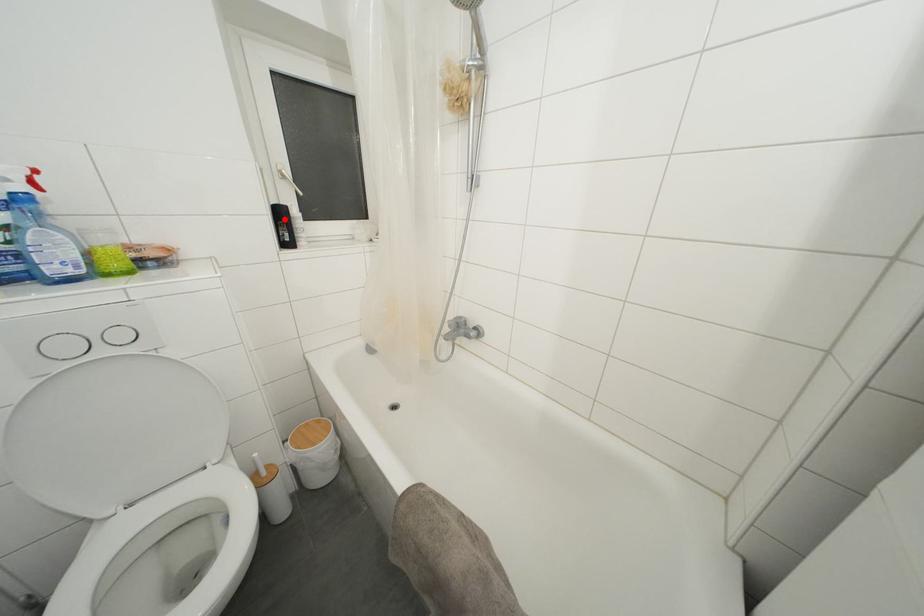
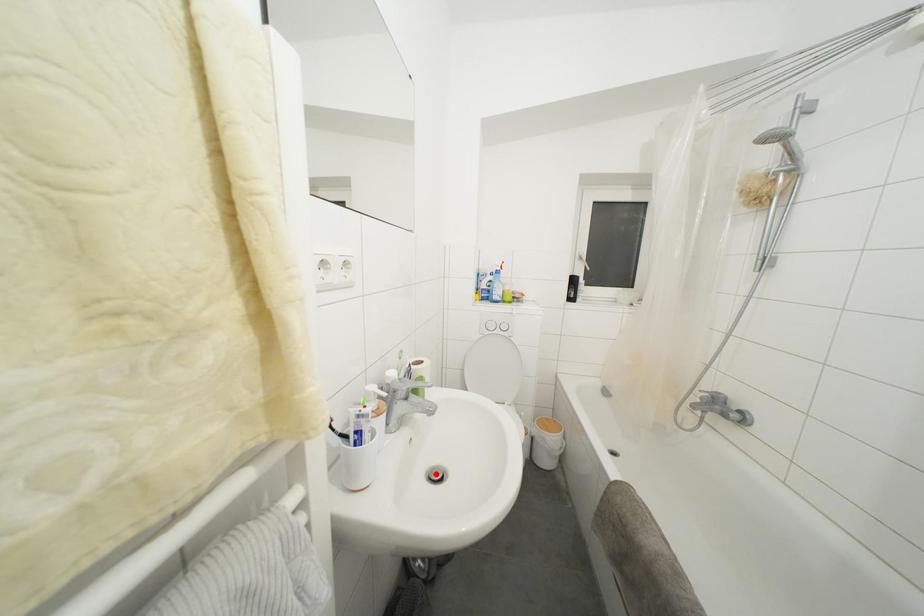
Looking at this image, I am providing you with two images of the same scene from different viewpoints. A red point is marked on the first image and another point is marked on the second image. Is the marked point in image1 the same physical position as the marked point in image2?

No